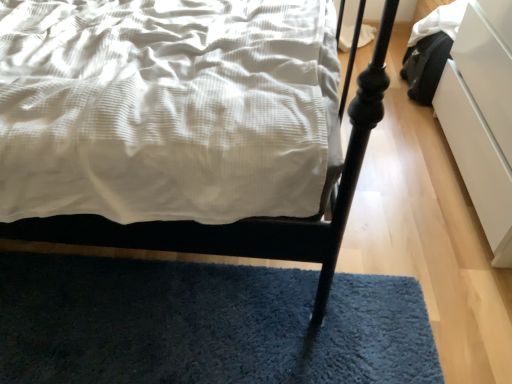
Question: Looking at the image, does blue shaggy rug at lower center seem bigger or smaller compared to matte white bed at center?

Choices:
 (A) big
 (B) small

Answer: (B)

Question: Relative to matte white bed at center, is blue shaggy rug at lower center in front or behind?

Choices:
 (A) front
 (B) behind

Answer: (B)

Question: Which object is positioned farthest from the blue shaggy rug at lower center?

Choices:
 (A) white glossy drawer at right
 (B) matte white bed at center

Answer: (A)

Question: Which object is positioned closest to the matte white bed at center?

Choices:
 (A) blue shaggy rug at lower center
 (B) white glossy drawer at right

Answer: (A)